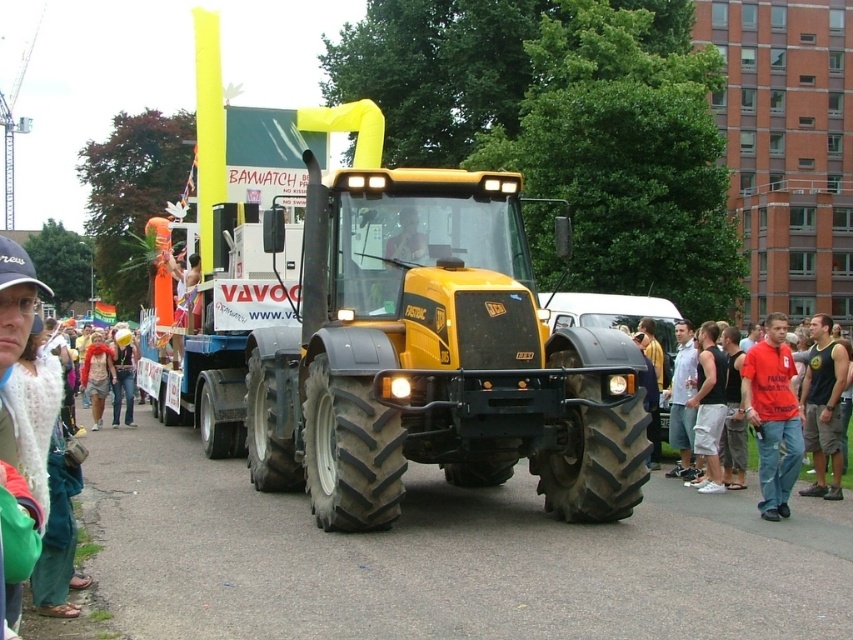
You are a photographer at the parade and need to capture both the red cotton shirt at lower right and the black tank top at right in a single frame. Which clothing item should you focus on to ensure both are visible without zooming in or out?

The red cotton shirt at lower right has a smaller size compared to black tank top at right. To ensure both are visible without adjusting the zoom, focus on the larger black tank top at right while keeping the smaller red cotton shirt at lower right within the frame.

You are a photographer at the parade and want to capture both the yellow matte tractor at center and the red cotton shirt at lower right in a single photo. Which object should you focus on first to ensure both are in frame?

The yellow matte tractor at center is larger in size than the red cotton shirt at lower right, so you should focus on the yellow matte tractor at center first to ensure both are in frame.

You are a photographer trying to capture both the yellow matte tractor at center and the black tank top at right in a single frame. Given their sizes, which object should you focus on to ensure both are clearly visible in your photo?

The yellow matte tractor at center is bigger than the black tank top at right, so you should focus on the tractor to ensure both are clearly visible in your photo.